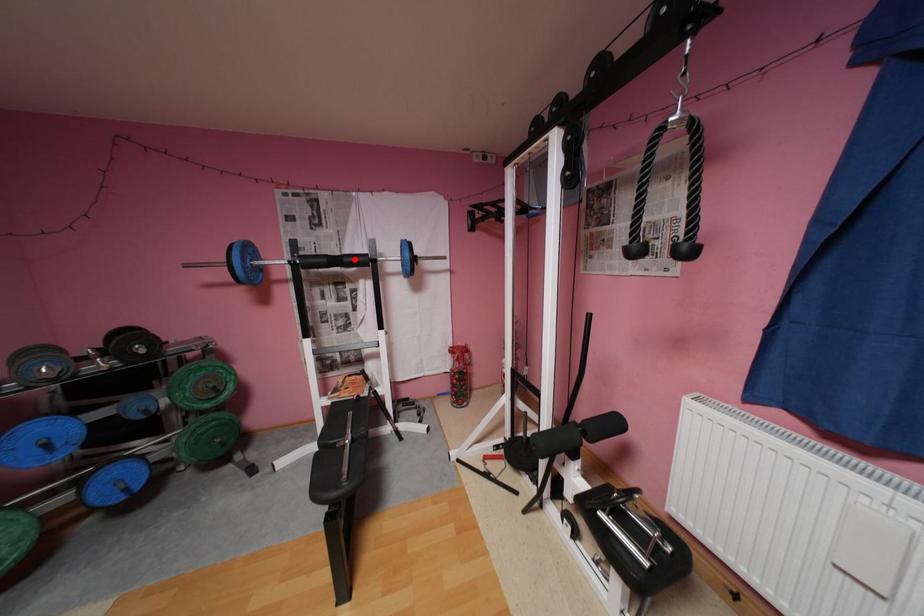
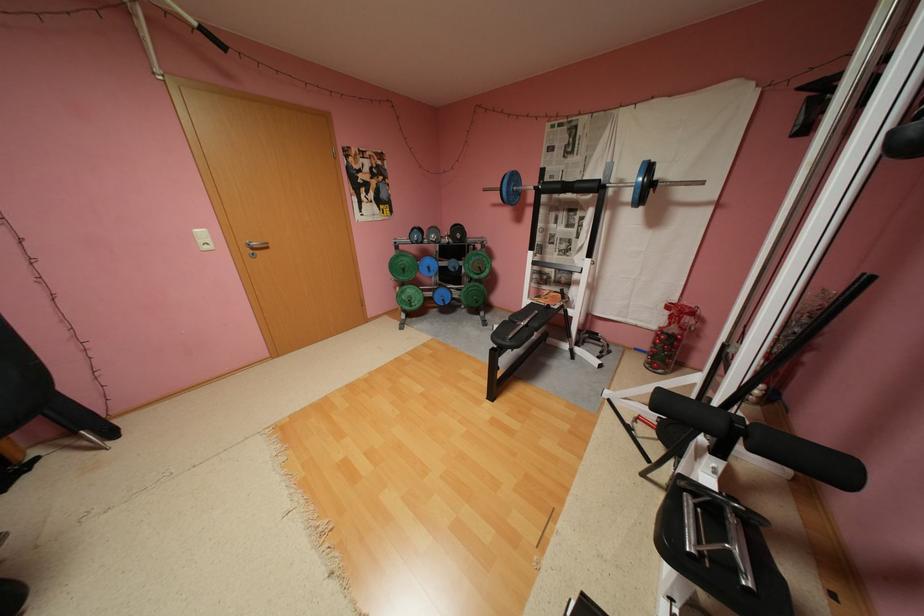
In the second image, find the point that corresponds to the highlighted location in the first image.

(586, 185)